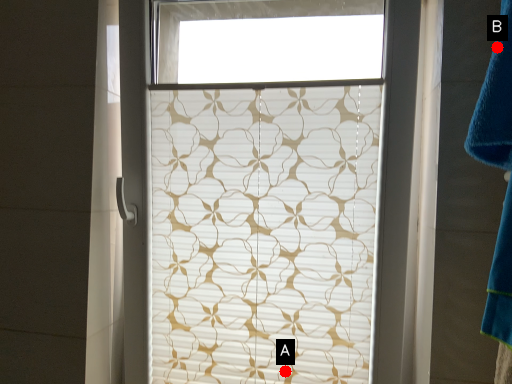
Question: Two points are circled on the image, labeled by A and B beside each circle. Which point is farther to the camera?

Choices:
 (A) A is further
 (B) B is further

Answer: (A)